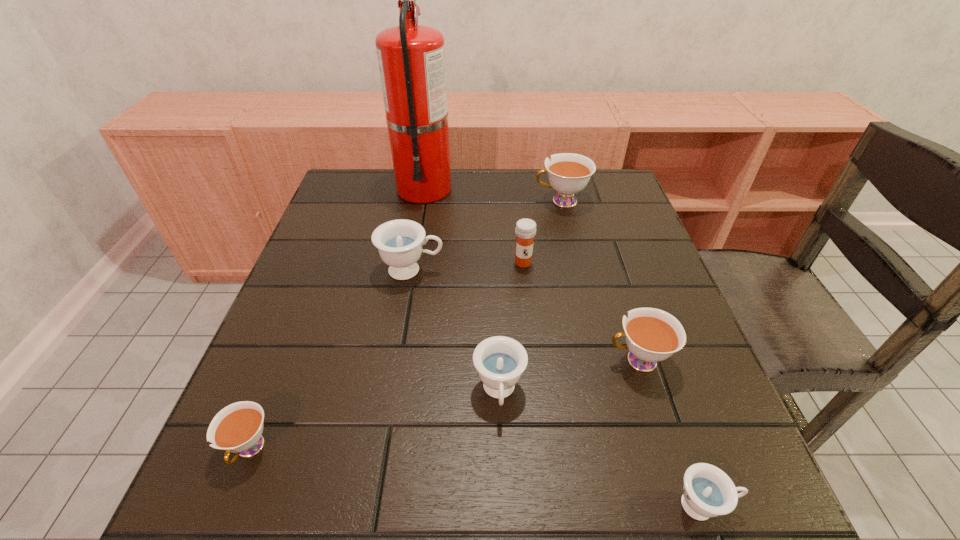
What are the coordinates of `blank region between the red fire extinguisher and the fourth teacup from right to left` in the screenshot? It's located at (462, 290).

Where is `free spot between the second farthest blue teacup and the nearest blue teacup`? Image resolution: width=960 pixels, height=540 pixels. free spot between the second farthest blue teacup and the nearest blue teacup is located at coordinates (601, 449).

The width and height of the screenshot is (960, 540). I want to click on free spot between the rightmost blue teacup and the second nearest white teacup, so click(x=671, y=433).

This screenshot has width=960, height=540. Identify the location of vacant area between the second smallest white teacup and the farthest white teacup. (600, 281).

Find the location of a particular element. The width and height of the screenshot is (960, 540). free space between the farthest blue teacup and the leftmost object is located at coordinates (330, 360).

Find the location of a particular element. unoccupied position between the smallest blue teacup and the leftmost blue teacup is located at coordinates pos(558,388).

Where is `unoccupied position between the leftmost object and the farthest white teacup`? unoccupied position between the leftmost object and the farthest white teacup is located at coordinates (405, 325).

The image size is (960, 540). I want to click on the seventh closest object relative to the fourth teacup from right to left, so click(x=411, y=58).

Select which object appears as the fourth closest to the second smallest white teacup. Please provide its 2D coordinates. Your answer should be formatted as a tuple, i.e. [(x, y)], where the tuple contains the x and y coordinates of a point satisfying the conditions above.

[(399, 242)]

Locate an element on the screen. The image size is (960, 540). teacup that stands as the third closest to the farthest blue teacup is located at coordinates (237, 428).